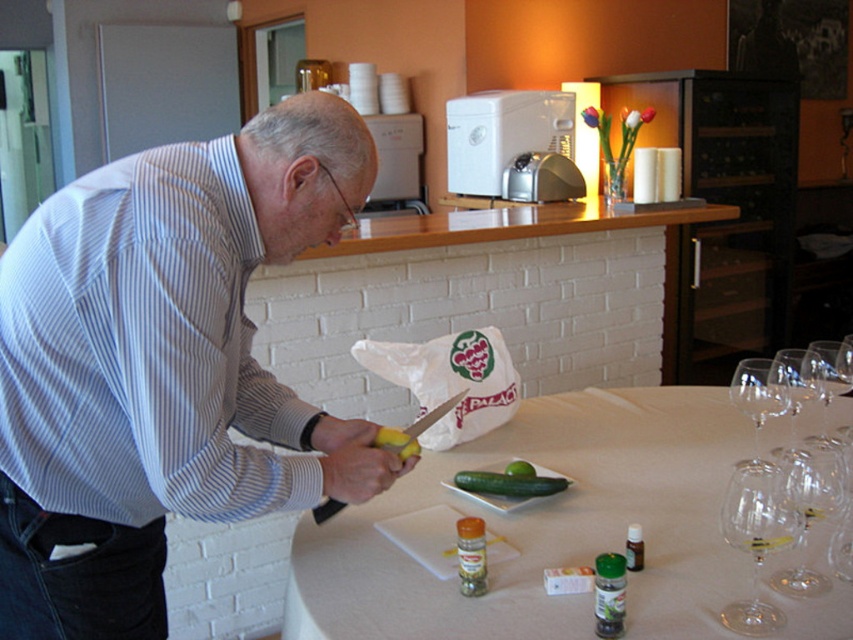
Question: Does clear glass wine glass at right appear on the left side of green smooth cucumber at center?

Choices:
 (A) no
 (B) yes

Answer: (A)

Question: Among these points, which one is nearest to the camera?

Choices:
 (A) (821, 342)
 (B) (757, 460)

Answer: (B)

Question: Which object is farther from the camera taking this photo?

Choices:
 (A) white matte table at center
 (B) transparent glass wine glass at upper right
 (C) striped cotton shirt at left

Answer: (B)

Question: Can you confirm if white matte table at center is thinner than green smooth cucumber at center?

Choices:
 (A) yes
 (B) no

Answer: (B)

Question: Is striped cotton shirt at left positioned behind white matte table at center?

Choices:
 (A) yes
 (B) no

Answer: (B)

Question: Which object is the closest to the wooden at upper center?

Choices:
 (A) striped cotton shirt at left
 (B) transparent glass wine glass at right
 (C) yellow rubber at center

Answer: (A)